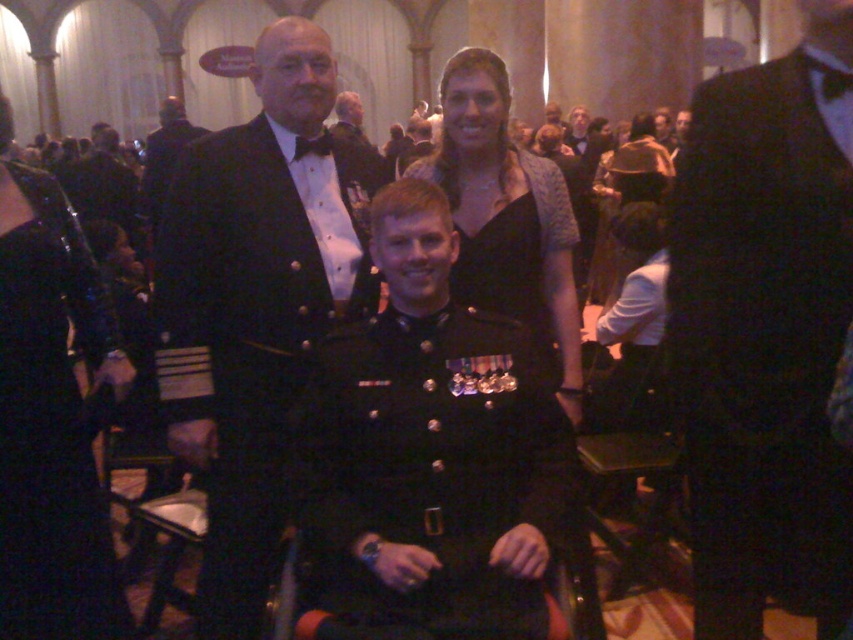
Between satin black dress at upper center and black satin bow tie at upper center, which one has less height?

black satin bow tie at upper center is shorter.

Does satin black dress at upper center appear on the right side of black satin bow tie at upper center?

No, satin black dress at upper center is not to the right of black satin bow tie at upper center.

Identify the location of satin black dress at upper center. The width and height of the screenshot is (853, 640). (51, 417).

Locate an element on the screen. satin black dress at upper center is located at coordinates (51, 417).

Does shiny black uniform at center appear under black satin bow tie at upper center?

Indeed, shiny black uniform at center is positioned under black satin bow tie at upper center.

Is point (381, 369) closer to viewer compared to point (325, 145)?

Yes, it is.

The image size is (853, 640). I want to click on shiny black uniform at center, so pos(431,449).

At what (x,y) coordinates should I click in order to perform the action: click on shiny black uniform at center. Please return your answer as a coordinate pair (x, y). Looking at the image, I should click on coord(431,449).

In the scene shown: Is black satin suit at center thinner than shiny black dress at upper center?

Yes, black satin suit at center is thinner than shiny black dress at upper center.

Is point (738, 179) positioned after point (514, 211)?

No, (738, 179) is closer to viewer.

Between point (793, 372) and point (509, 260), which one is positioned behind?

The point (509, 260) is behind.

Where is `black satin suit at center`? This screenshot has height=640, width=853. black satin suit at center is located at coordinates (766, 332).